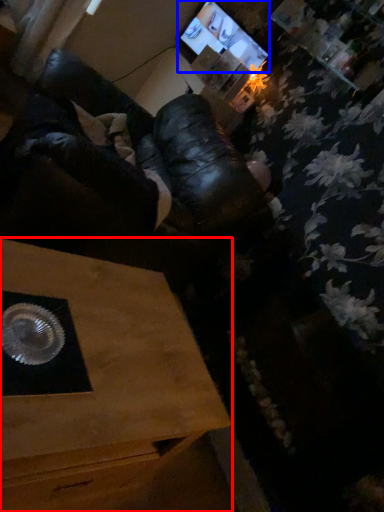
Question: Which object is further to the camera taking this photo, table (highlighted by a red box) or computer monitor (highlighted by a blue box)?

Choices:
 (A) table
 (B) computer monitor

Answer: (B)